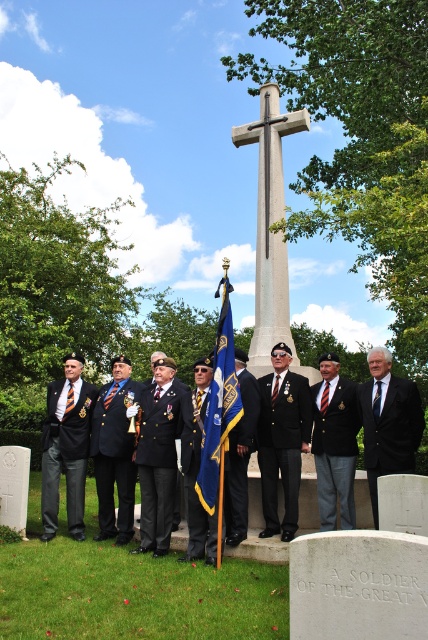
Question: Is blue fabric flag at center bigger than black wool suit at center?

Choices:
 (A) no
 (B) yes

Answer: (B)

Question: Is dark blue woolen suit at center to the right of dark blue wool suit at left from the viewer's perspective?

Choices:
 (A) yes
 (B) no

Answer: (A)

Question: Which point is farther to the camera?

Choices:
 (A) black satin suit at center
 (B) black wool suit at right
 (C) black satin flag at center

Answer: (A)

Question: Observing the image, what is the correct spatial positioning of black satin suit at center in reference to black wool suit at right?

Choices:
 (A) right
 (B) left

Answer: (B)

Question: Which object is positioned closest to the blue fabric flag at center?

Choices:
 (A) black wool suit at center
 (B) shiny black suit at center

Answer: (A)

Question: Which point is farther from the camera taking this photo?

Choices:
 (A) (160, 554)
 (B) (302, 532)
 (C) (237, 364)
 (D) (418, 412)

Answer: (C)